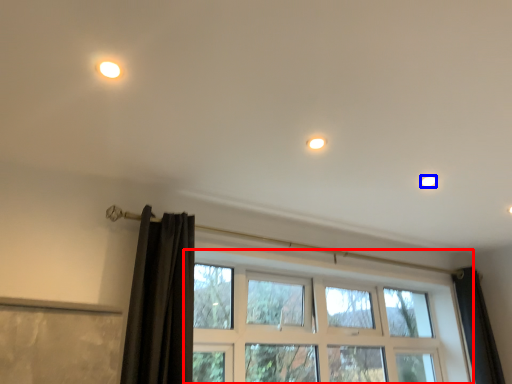
Question: Which object is closer to the camera taking this photo, window (highlighted by a red box) or dot (highlighted by a blue box)?

Choices:
 (A) window
 (B) dot

Answer: (A)